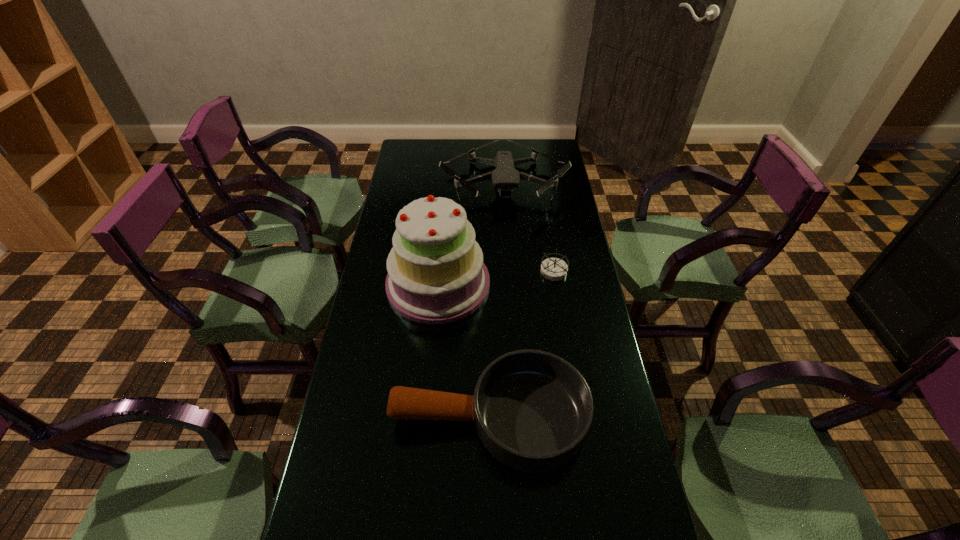
You are a GUI agent. You are given a task and a screenshot of the screen. Output one action in this format:
    pyautogui.click(x=<x>, y=<y>)
    Task: Click on the pan at the left edge
    This screenshot has height=540, width=960.
    Given the screenshot: What is the action you would take?
    click(x=532, y=410)

Where is `drone situated at the right edge`? This screenshot has height=540, width=960. drone situated at the right edge is located at coordinates tap(505, 177).

Find the location of `pan present at the right edge`. pan present at the right edge is located at coordinates (532, 410).

Locate an element on the screen. compass that is at the right edge is located at coordinates (554, 269).

In order to click on object that is at the far right corner in this screenshot , I will do `click(505, 177)`.

In order to click on vacant space at the far edge of the desktop in this screenshot , I will do `click(468, 148)`.

Image resolution: width=960 pixels, height=540 pixels. In the image, there is a desktop. In order to click on vacant space at the left edge in this screenshot , I will do pyautogui.click(x=379, y=372).

Image resolution: width=960 pixels, height=540 pixels. In the image, there is a desktop. In order to click on vacant space at the right edge in this screenshot , I will do `click(607, 406)`.

At what (x,y) coordinates should I click in order to perform the action: click on blank space at the far left corner of the desktop. Please return your answer as a coordinate pair (x, y). The height and width of the screenshot is (540, 960). Looking at the image, I should click on [x=424, y=164].

The width and height of the screenshot is (960, 540). I want to click on free point between the drone and the shortest object, so click(529, 228).